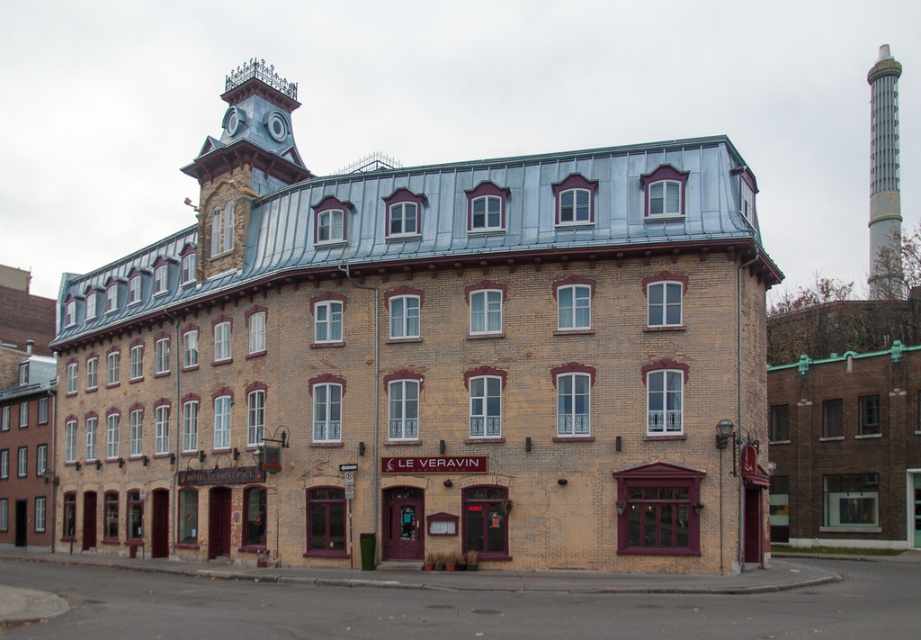
Question: Can you confirm if blue stone clock tower at upper left is positioned below silver metallic chimney at upper right?

Choices:
 (A) yes
 (B) no

Answer: (A)

Question: Which object appears closest to the camera in this image?

Choices:
 (A) blue stone clock tower at upper left
 (B) silver metallic chimney at upper right

Answer: (A)

Question: Which point is closer to the camera taking this photo?

Choices:
 (A) (243, 102)
 (B) (879, 70)

Answer: (A)

Question: Is blue stone clock tower at upper left to the right of silver metallic chimney at upper right from the viewer's perspective?

Choices:
 (A) no
 (B) yes

Answer: (A)

Question: Which object appears farthest from the camera in this image?

Choices:
 (A) silver metallic chimney at upper right
 (B) blue stone clock tower at upper left

Answer: (A)

Question: Does blue stone clock tower at upper left have a smaller size compared to silver metallic chimney at upper right?

Choices:
 (A) no
 (B) yes

Answer: (B)